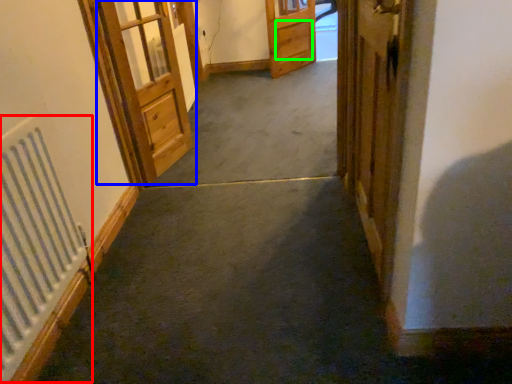
Question: Estimate the real-world distances between objects in this image. Which object is farther from radiator (highlighted by a red box), door (highlighted by a blue box) or drawer (highlighted by a green box)?

Choices:
 (A) door
 (B) drawer

Answer: (B)